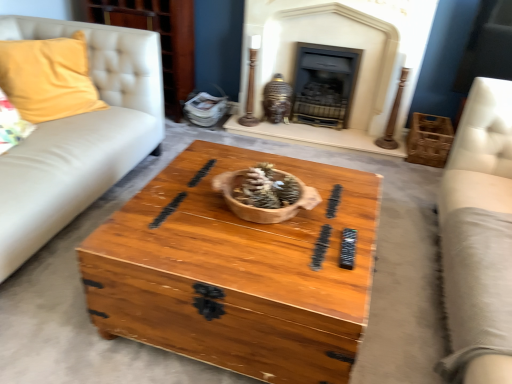
Question: Is yellow fabric pillow at left wider than dark gray stone fireplace at center, which appears as the second fireplace when viewed from the left?

Choices:
 (A) yes
 (B) no

Answer: (A)

Question: Does yellow fabric pillow at left have a lesser width compared to dark gray stone fireplace at center, the first fireplace when ordered from right to left?

Choices:
 (A) yes
 (B) no

Answer: (B)

Question: Does yellow fabric pillow at left turn towards dark gray stone fireplace at center, the first fireplace when ordered from right to left?

Choices:
 (A) no
 (B) yes

Answer: (A)

Question: Is yellow fabric pillow at left positioned beyond the bounds of dark gray stone fireplace at center, which appears as the second fireplace when viewed from the left?

Choices:
 (A) yes
 (B) no

Answer: (A)

Question: Is yellow fabric pillow at left smaller than dark gray stone fireplace at center, the first fireplace when ordered from right to left?

Choices:
 (A) yes
 (B) no

Answer: (B)

Question: Looking at the image, does wooden chest at center seem bigger or smaller compared to matte white dresser at upper left?

Choices:
 (A) big
 (B) small

Answer: (A)

Question: Is point (167, 198) closer or farther from the camera than point (184, 14)?

Choices:
 (A) closer
 (B) farther

Answer: (A)

Question: Looking at their shapes, would you say wooden chest at center is wider or thinner than matte white dresser at upper left?

Choices:
 (A) wide
 (B) thin

Answer: (A)

Question: Based on their positions, is wooden chest at center located to the left or right of matte white dresser at upper left?

Choices:
 (A) right
 (B) left

Answer: (A)

Question: Is yellow fabric pillow at left inside the boundaries of dark gray stone fireplace at center, which appears as the second fireplace when viewed from the left, or outside?

Choices:
 (A) outside
 (B) inside

Answer: (A)

Question: From a real-world perspective, relative to dark gray stone fireplace at center, which appears as the second fireplace when viewed from the left, is yellow fabric pillow at left vertically above or below?

Choices:
 (A) below
 (B) above

Answer: (B)

Question: Considering the positions of yellow fabric pillow at left and dark gray stone fireplace at center, the first fireplace when ordered from right to left, in the image, is yellow fabric pillow at left taller or shorter than dark gray stone fireplace at center, the first fireplace when ordered from right to left,?

Choices:
 (A) tall
 (B) short

Answer: (A)

Question: Considering the positions of yellow fabric pillow at left and dark gray stone fireplace at center, which appears as the second fireplace when viewed from the left, in the image, is yellow fabric pillow at left wider or thinner than dark gray stone fireplace at center, which appears as the second fireplace when viewed from the left,?

Choices:
 (A) wide
 (B) thin

Answer: (A)

Question: Is wooden crate at right bigger or smaller than matte white dresser at upper left?

Choices:
 (A) small
 (B) big

Answer: (A)

Question: Considering the positions of wooden crate at right and matte white dresser at upper left in the image, is wooden crate at right taller or shorter than matte white dresser at upper left?

Choices:
 (A) tall
 (B) short

Answer: (B)